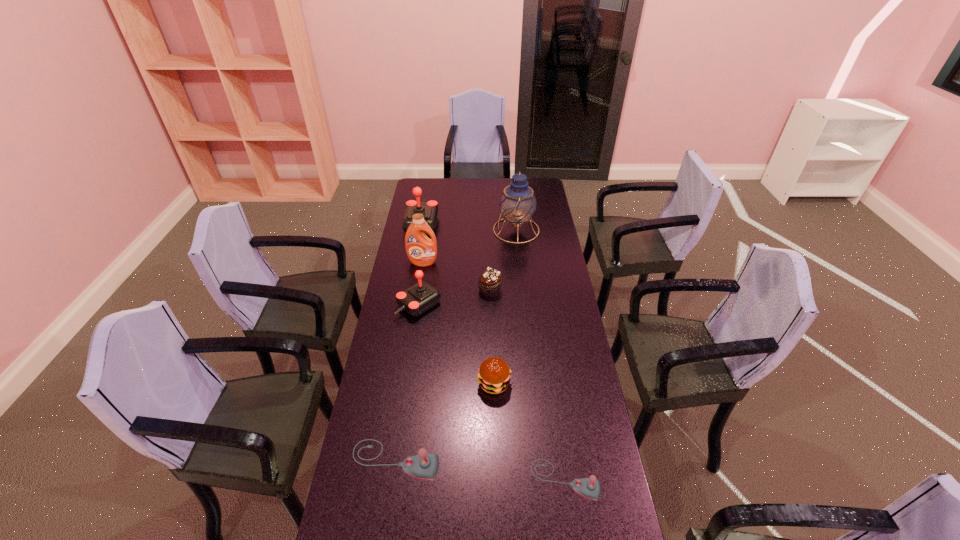
Identify the location of blue lantern. This screenshot has height=540, width=960. (518, 203).

The width and height of the screenshot is (960, 540). In order to click on the tallest object in this screenshot , I will do [x=518, y=203].

Find the location of a particular element. The height and width of the screenshot is (540, 960). the third farthest object is located at coordinates (421, 251).

Identify the location of the seventh shortest object. The width and height of the screenshot is (960, 540). (421, 251).

Locate an element on the screen. The height and width of the screenshot is (540, 960). the sixth shortest object is located at coordinates (430, 208).

Find the location of a particular element. The image size is (960, 540). the farther red joystick is located at coordinates (430, 208).

Find the location of a particular element. the fifth shortest object is located at coordinates (419, 298).

Where is `the nearer red joystick`? This screenshot has height=540, width=960. the nearer red joystick is located at coordinates (419, 298).

Locate an element on the screen. cupcake is located at coordinates (490, 281).

Identify the location of the sixth farthest object. (494, 375).